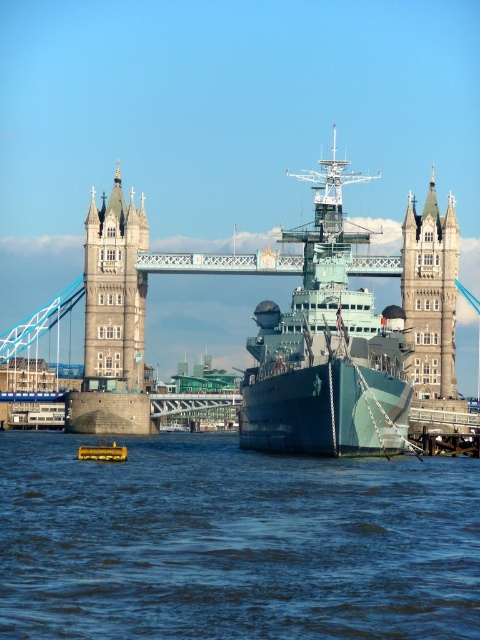
You are standing at the point marked as point (233, 541). What object are you currently standing on?

You are standing on the blue water at center, which is located at point (233, 541).

You are a tour guide explaining the view of Tower Bridge to visitors. Pointing at the teal matte battleship at center and the stone tower at center, you want to highlight their spatial relationship. Which object is located below the other?

The teal matte battleship at center is positioned under the stone tower at center.

You are a photographer planning to capture the Tower Bridge and the naval ship in one shot. Given that the blue water at center and the stone tower at left are both in your frame, which object appears taller in the photograph?

The stone tower at left appears taller than the blue water at center in the photograph because the stone tower at left is taller than the blue water at center according to the description.